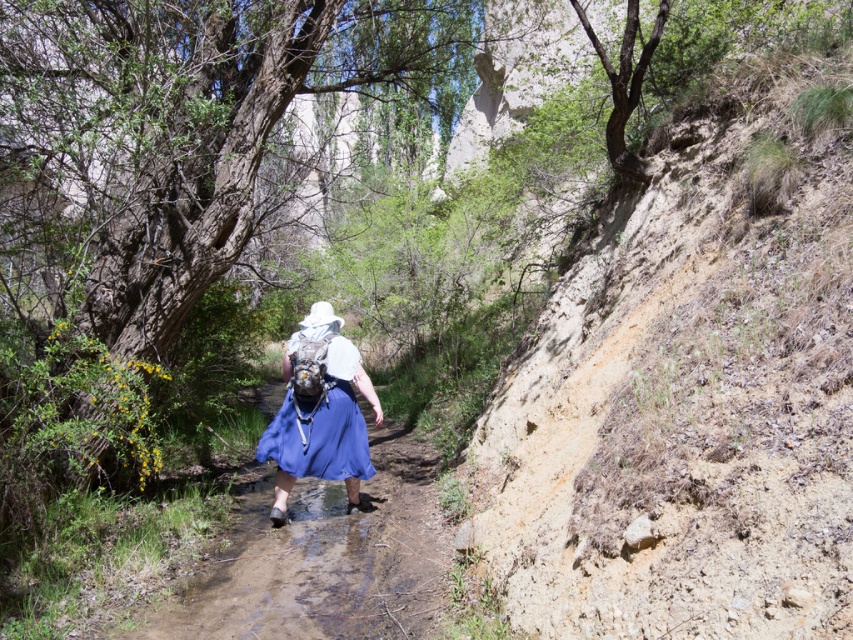
Between blue fabric skirt at center and blue satin dress at center, which one appears on the right side from the viewer's perspective?

From the viewer's perspective, blue fabric skirt at center appears more on the right side.

Is blue fabric skirt at center closer to the viewer compared to blue satin dress at center?

Yes.

Does point (360, 636) lie behind point (350, 449)?

No, (360, 636) is closer to viewer.

In order to click on blue fabric skirt at center in this screenshot , I will do `click(323, 557)`.